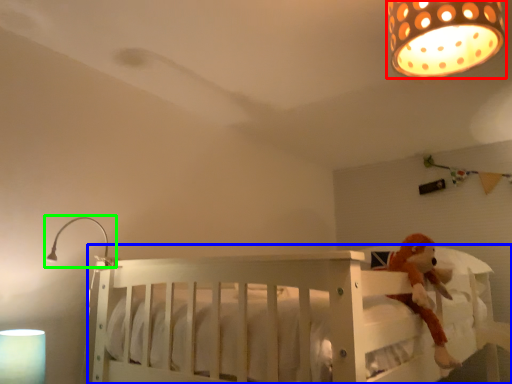
Question: Which object is positioned closest to lamp (highlighted by a red box)? Select from infant bed (highlighted by a blue box) and lamp (highlighted by a green box).

Choices:
 (A) infant bed
 (B) lamp

Answer: (A)